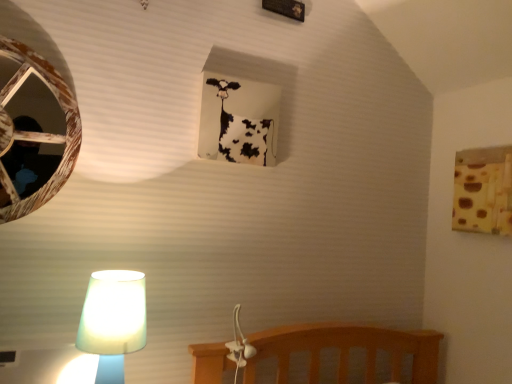
Question: From a real-world perspective, is white paper at upper center, the second window frame from the right, physically located above or below wooden birdhouse at left?

Choices:
 (A) below
 (B) above

Answer: (B)

Question: In the image, is white paper at upper center, the first window frame positioned from the left, positioned in front of or behind wooden birdhouse at left?

Choices:
 (A) behind
 (B) front

Answer: (A)

Question: Considering the real-world distances, which object is farthest from the brown textured fabric at upper right, the first window frame positioned from the bottom?

Choices:
 (A) wooden birdhouse at left
 (B) translucent glass lamp at lower left
 (C) white paper at upper center, the second window frame from the bottom

Answer: (A)

Question: Which object is positioned closest to the white paper at upper center, the first window frame positioned from the left?

Choices:
 (A) brown textured fabric at upper right, the first window frame positioned from the bottom
 (B) wooden birdhouse at left
 (C) translucent glass lamp at lower left

Answer: (B)